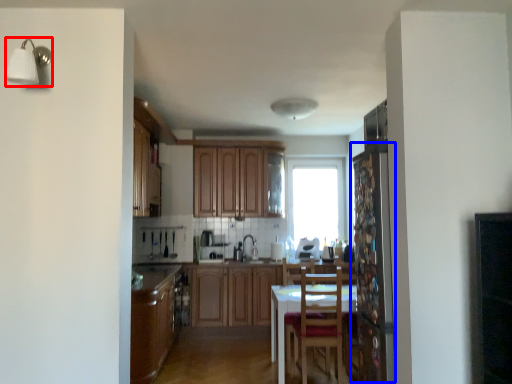
Question: Which of the following is the farthest to the observer, light fixture (highlighted by a red box) or screen door (highlighted by a blue box)?

Choices:
 (A) light fixture
 (B) screen door

Answer: (B)